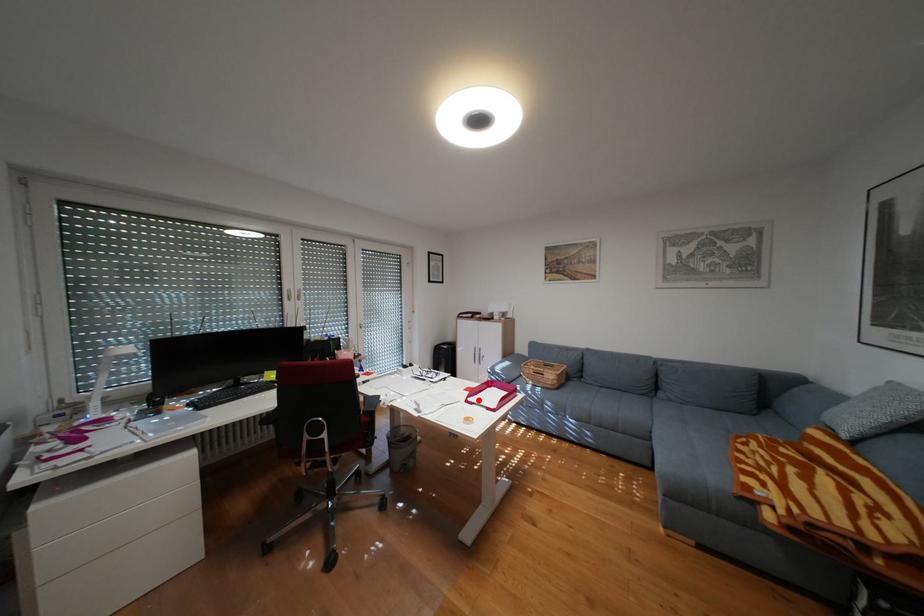
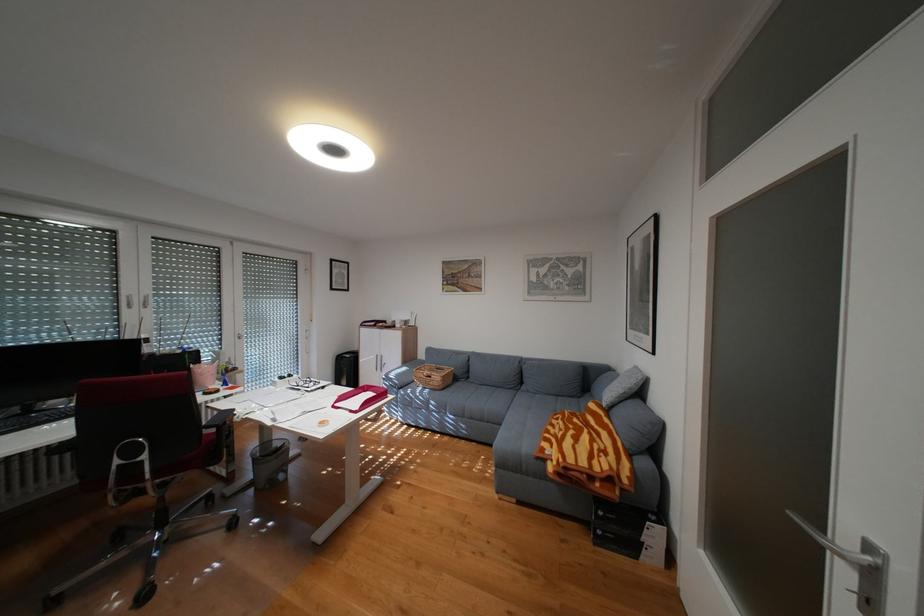
Where in the second image is the point corresponding to the highlighted location from the first image?

(346, 406)